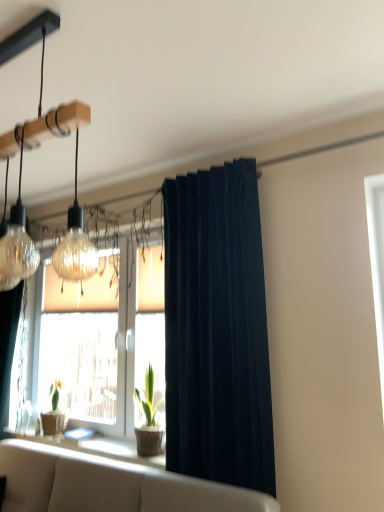
Question: Considering the positions of point (145, 437) and point (0, 271), is point (145, 437) closer or farther from the camera than point (0, 271)?

Choices:
 (A) closer
 (B) farther

Answer: (B)

Question: Visually, is green matte plant at center positioned to the left or to the right of matte glass pendant light at upper left?

Choices:
 (A) left
 (B) right

Answer: (B)

Question: Considering the real-world distances, which object is farthest from the beige fabric couch at lower center?

Choices:
 (A) translucent glass window at center
 (B) dark blue velvet curtain at center
 (C) wooden textured window sill at lower center
 (D) green matte plant at center
 (E) matte glass pendant light at upper left

Answer: (E)

Question: Estimate the real-world distances between objects in this image. Which object is farther from the green matte plant at center?

Choices:
 (A) matte glass pendant light at upper left
 (B) translucent glass window at center
 (C) beige fabric couch at lower center
 (D) wooden textured window sill at lower center
 (E) dark blue velvet curtain at center

Answer: (A)